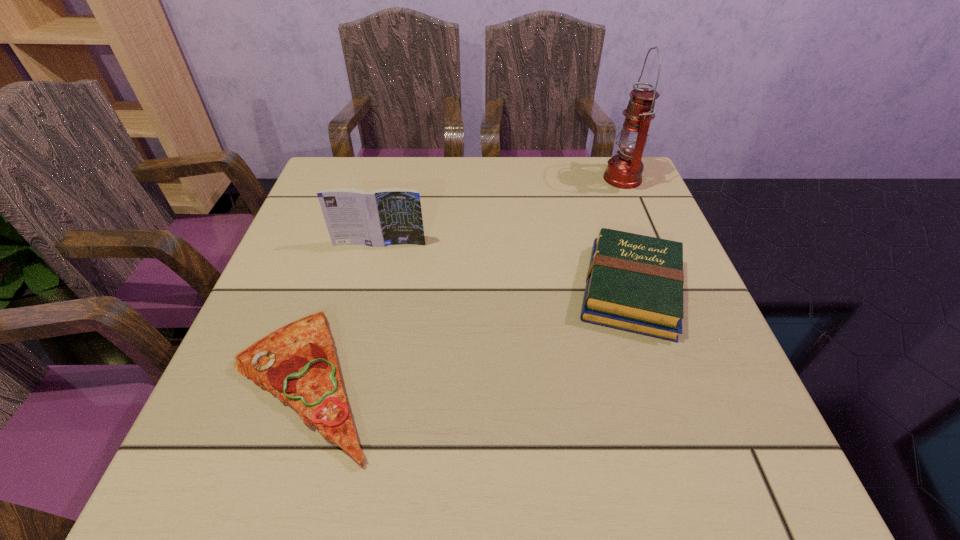
The height and width of the screenshot is (540, 960). In order to click on the tallest object in this screenshot , I will do `click(624, 170)`.

Image resolution: width=960 pixels, height=540 pixels. Find the location of `oil lamp`. oil lamp is located at coordinates (624, 170).

This screenshot has width=960, height=540. Find the location of `the left book`. the left book is located at coordinates (391, 216).

Locate an element on the screen. the taller book is located at coordinates (391, 216).

This screenshot has height=540, width=960. Find the location of `the shorter book`. the shorter book is located at coordinates (634, 283).

Locate an element on the screen. This screenshot has width=960, height=540. the right book is located at coordinates (634, 283).

Locate an element on the screen. pizza is located at coordinates (297, 363).

Identify the location of vacant space located 0.400m on the front of the oil lamp. This screenshot has height=540, width=960. (678, 311).

Image resolution: width=960 pixels, height=540 pixels. In order to click on free location located on the front cover of the left book in this screenshot , I will do `click(358, 332)`.

Identify the location of free location located on the left of the second shortest object. The height and width of the screenshot is (540, 960). (396, 289).